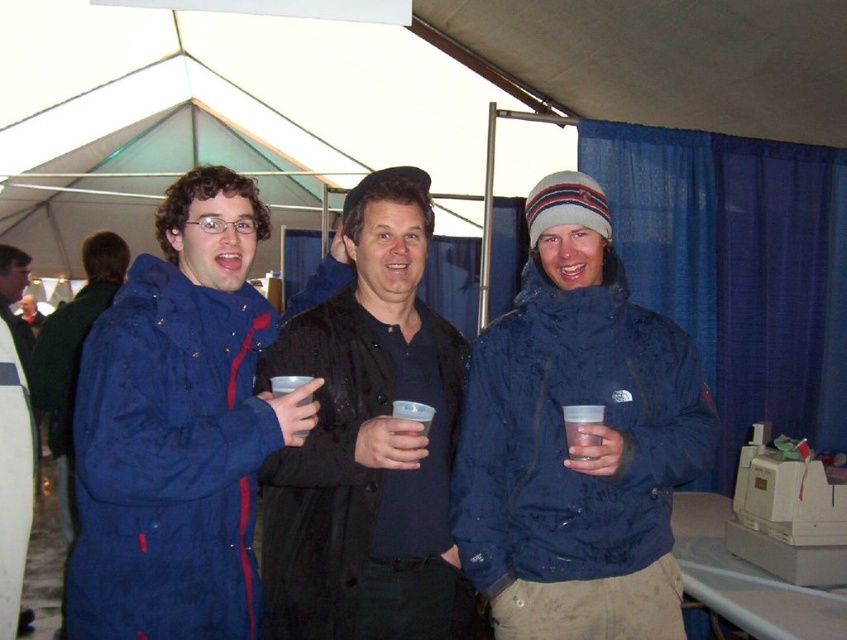
Is blue matte jacket at center wider than matte blue coat at left?

Yes.

Is blue matte jacket at center thinner than matte blue coat at left?

No.

Between point (615, 396) and point (205, 616), which one is positioned behind?

The point (615, 396) is behind.

Where is `blue matte jacket at center`? This screenshot has width=847, height=640. blue matte jacket at center is located at coordinates (576, 442).

Who is taller, matte blue coat at left or black matte jacket at center?

black matte jacket at center

Does matte blue coat at left have a lesser height compared to black matte jacket at center?

Yes.

Who is more distant from viewer, (268, 330) or (441, 449)?

The point (268, 330) is more distant.

Where is `matte blue coat at left`? The height and width of the screenshot is (640, 847). matte blue coat at left is located at coordinates (176, 428).

Is blue matte jacket at center wider than black matte jacket at center?

Yes, blue matte jacket at center is wider than black matte jacket at center.

Can you confirm if blue matte jacket at center is positioned above black matte jacket at center?

Yes.

Find the location of a particular element. Image resolution: width=847 pixels, height=640 pixels. blue matte jacket at center is located at coordinates (x=576, y=442).